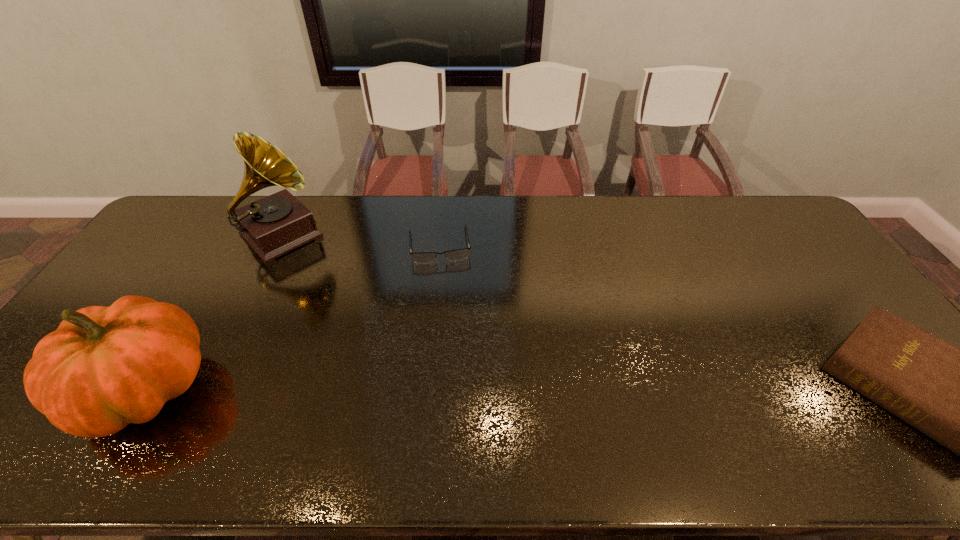
Locate an element on the screen. This screenshot has width=960, height=540. vacant region at the far left corner of the desktop is located at coordinates (212, 198).

The image size is (960, 540). I want to click on vacant space at the far right corner, so click(x=743, y=209).

The height and width of the screenshot is (540, 960). What are the coordinates of `vacant point located between the tallest object and the second object from right to left` in the screenshot? It's located at (361, 240).

This screenshot has width=960, height=540. I want to click on free point between the tallest object and the third shortest object, so click(214, 312).

Image resolution: width=960 pixels, height=540 pixels. Identify the location of free space between the third shortest object and the phonograph record. (214, 312).

Find the location of `empty space between the pumpkin and the shortest object`. empty space between the pumpkin and the shortest object is located at coordinates point(293,317).

Locate an element on the screen. Image resolution: width=960 pixels, height=540 pixels. the second closest object to the second shortest object is located at coordinates (279, 223).

You are a GUI agent. You are given a task and a screenshot of the screen. Output one action in this format:
    pyautogui.click(x=<x>, y=<y>)
    Task: Click on the object that ranks as the third closest to the pumpkin
    The height and width of the screenshot is (540, 960).
    Given the screenshot: What is the action you would take?
    pyautogui.click(x=959, y=397)

Image resolution: width=960 pixels, height=540 pixels. Find the location of `vacant region that satisfies the following two spatial constraints: 1. on the back side of the second tallest object; 2. on the left side of the tallest object`. vacant region that satisfies the following two spatial constraints: 1. on the back side of the second tallest object; 2. on the left side of the tallest object is located at coordinates (239, 235).